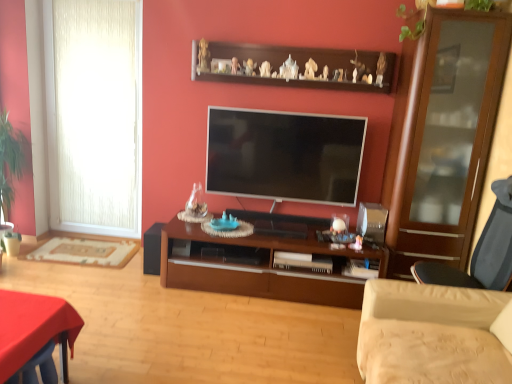
Describe the element at coordinates (11, 160) in the screenshot. The width and height of the screenshot is (512, 384). I see `green leafy plant at left, the first plant when ordered from left to right` at that location.

Find the location of `brown wooden shelf at upper center`. brown wooden shelf at upper center is located at coordinates (292, 65).

What is the approximate height of beige fabric studio couch at lower right?

beige fabric studio couch at lower right is 30.31 inches tall.

The width and height of the screenshot is (512, 384). What do you see at coordinates (432, 334) in the screenshot?
I see `beige fabric studio couch at lower right` at bounding box center [432, 334].

Locate an element on the screen. This screenshot has height=384, width=512. dark gray fabric chair at right is located at coordinates (481, 251).

In order to click on smooth red table at lower left in this screenshot , I will do `click(31, 326)`.

Does green leafy plant at upper right, which is the first plant from top to bottom, lie in front of brown wooden shelf at upper center?

Yes, green leafy plant at upper right, which is the first plant from top to bottom, is closer to the viewer.

Considering the positions of points (473, 8) and (341, 55), is point (473, 8) farther from camera compared to point (341, 55)?

No, (473, 8) is closer to viewer.

From the picture: Could you tell me if green leafy plant at upper right, the second plant viewed from the left, is turned towards brown wooden shelf at upper center?

No, green leafy plant at upper right, the second plant viewed from the left, is not turned towards brown wooden shelf at upper center.

From a real-world perspective, between green leafy plant at upper right, the 1th plant positioned from the front, and brown wooden shelf at upper center, who is vertically higher?

green leafy plant at upper right, the 1th plant positioned from the front, is physically above.

How far apart are white textured curtain at left and dark gray fabric chair at right?

The distance of white textured curtain at left from dark gray fabric chair at right is 2.93 meters.

Consider the image. Relative to dark gray fabric chair at right, is white textured curtain at left in front or behind?

Clearly, white textured curtain at left is behind dark gray fabric chair at right.

Is white textured curtain at left situated inside dark gray fabric chair at right or outside?

white textured curtain at left is not enclosed by dark gray fabric chair at right.

Considering the sizes of objects white textured curtain at left and dark gray fabric chair at right in the image provided, who is wider, white textured curtain at left or dark gray fabric chair at right?

dark gray fabric chair at right.

Are flat screen tv at center and dark gray fabric chair at right far apart?

Yes, flat screen tv at center and dark gray fabric chair at right are quite far apart.

This screenshot has width=512, height=384. What are the coordinates of `television behind the dark gray fabric chair at right` in the screenshot? It's located at (284, 155).

Looking at this image, is the position of flat screen tv at center less distant than that of dark gray fabric chair at right?

No, it is behind dark gray fabric chair at right.

Could you tell me if flat screen tv at center is turned towards dark gray fabric chair at right?

No.

Which point is more distant from viewer, (29, 333) or (123, 95)?

The point (123, 95) is farther.

Considering the relative sizes of smooth red table at lower left and white textured curtain at left in the image provided, is smooth red table at lower left shorter than white textured curtain at left?

Yes.

Is white textured curtain at left surrounded by smooth red table at lower left?

No, white textured curtain at left is not inside smooth red table at lower left.

Are flat screen tv at center and beige fabric studio couch at lower right located far from each other?

Yes, flat screen tv at center and beige fabric studio couch at lower right are located far from each other.

Considering the positions of objects flat screen tv at center and beige fabric studio couch at lower right in the image provided, who is more to the right, flat screen tv at center or beige fabric studio couch at lower right?

beige fabric studio couch at lower right is more to the right.

At what (x,y) coordinates should I click in order to perform the action: click on studio couch below the flat screen tv at center (from a real-world perspective). Please return your answer as a coordinate pair (x, y). Looking at the image, I should click on (432, 334).

Can you tell me how much flat screen tv at center and beige fabric studio couch at lower right differ in facing direction?

The angular difference between flat screen tv at center and beige fabric studio couch at lower right is 90 degrees.

From a real-world perspective, is dark gray fabric chair at right on top of brown wooden shelf at upper center?

Incorrect, from a real-world perspective, dark gray fabric chair at right is lower than brown wooden shelf at upper center.

Does point (497, 288) come in front of point (247, 82)?

Yes, point (497, 288) is in front of point (247, 82).

Is dark gray fabric chair at right wider than brown wooden shelf at upper center?

Yes, dark gray fabric chair at right is wider than brown wooden shelf at upper center.

In the image, is dark gray fabric chair at right on the left side or the right side of brown wooden shelf at upper center?

dark gray fabric chair at right is positioned on brown wooden shelf at upper center's right side.

From a real-world perspective, is green leafy plant at upper right, which is counted as the 2th plant, starting from the bottom, physically located above or below flat screen tv at center?

In terms of real-world spatial position, green leafy plant at upper right, which is counted as the 2th plant, starting from the bottom, is above flat screen tv at center.

Does green leafy plant at upper right, placed as the second plant when sorted from back to front, have a lesser height compared to flat screen tv at center?

Correct, green leafy plant at upper right, placed as the second plant when sorted from back to front, is not as tall as flat screen tv at center.

Does green leafy plant at upper right, placed as the first plant when sorted from right to left, have a smaller size compared to flat screen tv at center?

Yes, green leafy plant at upper right, placed as the first plant when sorted from right to left, is smaller than flat screen tv at center.

Consider the image. Is green leafy plant at upper right, the 1th plant positioned from the front, aimed at flat screen tv at center?

No, green leafy plant at upper right, the 1th plant positioned from the front, is not turned towards flat screen tv at center.

The image size is (512, 384). I want to click on shelf that is under the green leafy plant at upper right, which is counted as the 2th plant, starting from the bottom (from a real-world perspective), so click(292, 65).

Identify the location of window above the dark gray fabric chair at right (from the image's perspective). (96, 116).

Looking at the image, which one is located further to flat screen tv at center, smooth red table at lower left or green leafy plant at left, which is counted as the 1th plant, starting from the back?

Based on the image, green leafy plant at left, which is counted as the 1th plant, starting from the back, appears to be further to flat screen tv at center.

Looking at the image, which one is located closer to smooth red table at lower left, green leafy plant at left, acting as the 2th plant starting from the front, or green leafy plant at upper right, placed as the first plant when sorted from right to left?

green leafy plant at left, acting as the 2th plant starting from the front, is closer to smooth red table at lower left.

Based on their spatial positions, is brown wooden shelf at upper center or green leafy plant at upper right, the second plant viewed from the left, closer to white textured curtain at left?

Among the two, brown wooden shelf at upper center is located nearer to white textured curtain at left.

From the image, which object appears to be nearer to dark gray fabric chair at right, beige fabric studio couch at lower right or smooth red table at lower left?

beige fabric studio couch at lower right is positioned closer to the anchor dark gray fabric chair at right.

From the image, which object appears to be farther from brown wood cabinet at center, smooth red table at lower left or dark gray fabric chair at right?

smooth red table at lower left lies further to brown wood cabinet at center than the other object.

From the image, which object appears to be nearer to dark gray fabric chair at right, white textured curtain at left or green leafy plant at upper right, which is counted as the 2th plant, starting from the bottom?

green leafy plant at upper right, which is counted as the 2th plant, starting from the bottom, is positioned closer to the anchor dark gray fabric chair at right.

Based on their spatial positions, is brown wooden shelf at upper center or dark gray fabric chair at right further from green leafy plant at left, which is counted as the second plant, starting from the top?

dark gray fabric chair at right is positioned further to the anchor green leafy plant at left, which is counted as the second plant, starting from the top.

Estimate the real-world distances between objects in this image. Which object is closer to green leafy plant at left, which is counted as the 1th plant, starting from the back, brown wood cabinet at center or green leafy plant at upper right, the 1th plant positioned from the front?

brown wood cabinet at center is positioned closer to the anchor green leafy plant at left, which is counted as the 1th plant, starting from the back.

Find the location of a particular element. chair located between beige fabric studio couch at lower right and flat screen tv at center in the depth direction is located at coordinates (481, 251).

Identify the location of shelf between beige fabric studio couch at lower right and white textured curtain at left from front to back. (292, 65).

At what (x,y) coordinates should I click in order to perform the action: click on studio couch situated between smooth red table at lower left and green leafy plant at upper right, placed as the second plant when sorted from back to front, from left to right. Please return your answer as a coordinate pair (x, y). Image resolution: width=512 pixels, height=384 pixels. Looking at the image, I should click on (432, 334).

Find the location of a particular element. The width and height of the screenshot is (512, 384). chair that lies between green leafy plant at upper right, which is the first plant from top to bottom, and brown wood cabinet at center from top to bottom is located at coordinates (481, 251).